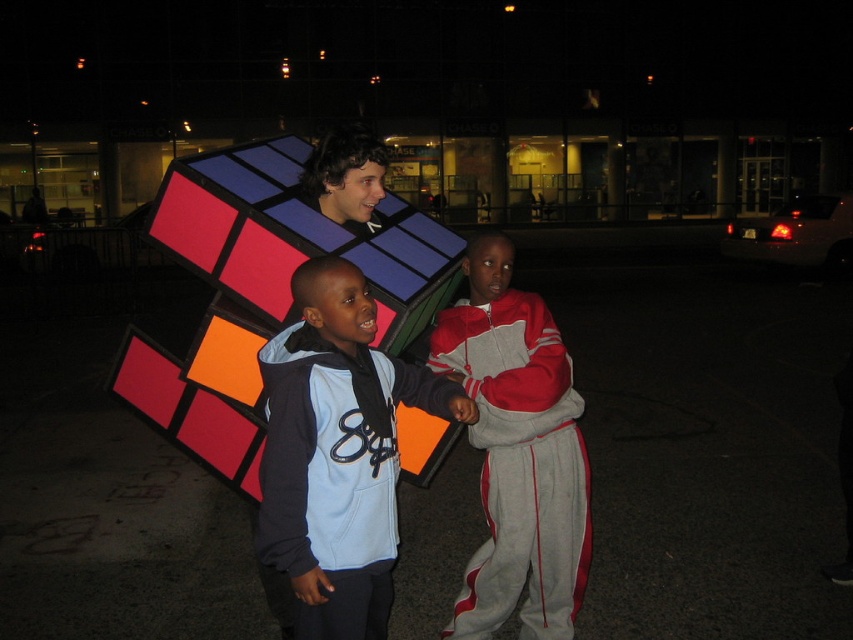
Who is more forward, (x=386, y=563) or (x=538, y=374)?

Positioned in front is point (x=386, y=563).

Measure the distance between point (312,449) and camera.

A distance of 6.80 feet exists between point (312,449) and camera.

Is point (312, 307) more distant than point (508, 436)?

No, (312, 307) is in front of (508, 436).

Image resolution: width=853 pixels, height=640 pixels. What are the coordinates of `light blue fleece jacket at center` in the screenshot? It's located at pos(337,452).

Is light blue fleece jacket at center above shiny plastic rubik's cube at center?

Incorrect, light blue fleece jacket at center is not positioned above shiny plastic rubik's cube at center.

The image size is (853, 640). Describe the element at coordinates (337, 452) in the screenshot. I see `light blue fleece jacket at center` at that location.

Locate an element on the screen. light blue fleece jacket at center is located at coordinates (337, 452).

This screenshot has width=853, height=640. What do you see at coordinates (517, 452) in the screenshot?
I see `gray fleece tracksuit at center` at bounding box center [517, 452].

Is gray fleece tracksuit at center closer to camera compared to shiny plastic rubik's cube at center?

That is True.

The width and height of the screenshot is (853, 640). What do you see at coordinates (517, 452) in the screenshot?
I see `gray fleece tracksuit at center` at bounding box center [517, 452].

Locate an element on the screen. gray fleece tracksuit at center is located at coordinates (x=517, y=452).